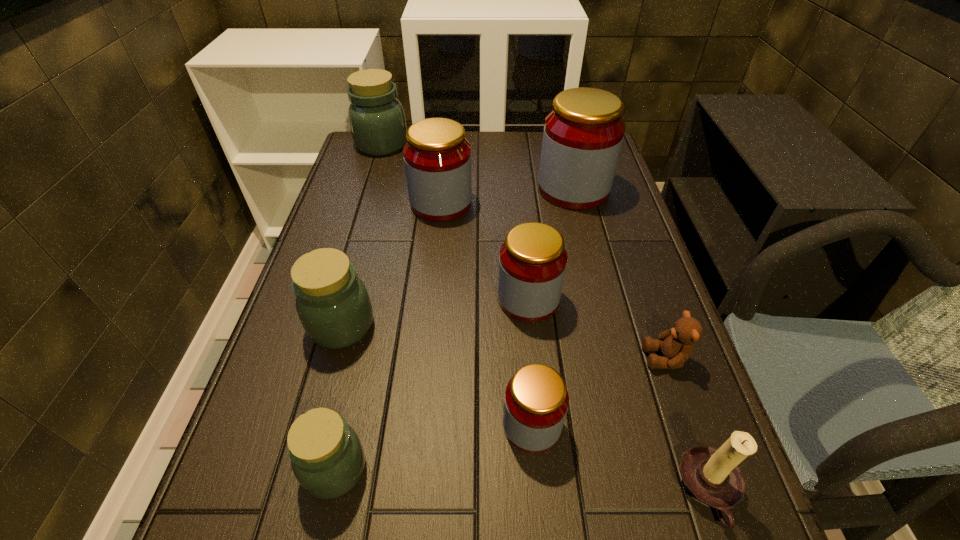
Locate an element on the screen. teddy bear is located at coordinates (676, 345).

You are a GUI agent. You are given a task and a screenshot of the screen. Output one action in this format:
    pyautogui.click(x=<x>, y=<y>)
    Task: Click on the vacant space located 0.160m on the left of the tallest jar
    Image resolution: width=960 pixels, height=540 pixels.
    Given the screenshot: What is the action you would take?
    pyautogui.click(x=484, y=189)

Image resolution: width=960 pixels, height=540 pixels. What are the coordinates of `blank area located 0.270m on the right of the biggest green jar` in the screenshot? It's located at 489,144.

Find the location of `vacant space located on the back of the second biggest red jar`. vacant space located on the back of the second biggest red jar is located at coordinates (445, 160).

Locate an element on the screen. free location located 0.110m on the back of the second smallest green jar is located at coordinates (358, 266).

The height and width of the screenshot is (540, 960). I want to click on free spot located 0.340m on the left of the third farthest red jar, so click(348, 299).

The image size is (960, 540). What are the coordinates of `vacant space located 0.110m on the wick of the brown candle holder` in the screenshot? It's located at (612, 491).

I want to click on vacant region located on the wick of the brown candle holder, so click(519, 491).

This screenshot has width=960, height=540. I want to click on vacant space located 0.050m on the wick of the brown candle holder, so click(648, 491).

You are a GUI agent. You are given a task and a screenshot of the screen. Output one action in this format:
    pyautogui.click(x=<x>, y=<y>)
    Task: Click on the blank space located 0.060m on the front of the nearest red jar
    The height and width of the screenshot is (540, 960).
    Given the screenshot: What is the action you would take?
    pyautogui.click(x=538, y=491)